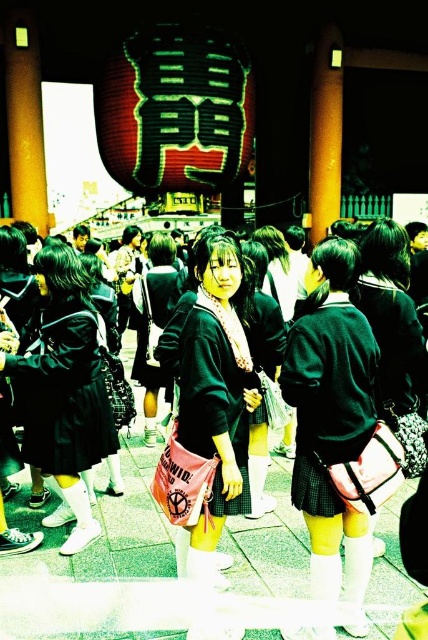
Which of these two, matte green uniform at center or matte black sweater at center, stands shorter?

matte green uniform at center is shorter.

Does matte green uniform at center have a larger size compared to matte black sweater at center?

Correct, matte green uniform at center is larger in size than matte black sweater at center.

Between point (357, 321) and point (190, 552), which one is positioned behind?

Positioned behind is point (357, 321).

This screenshot has width=428, height=640. I want to click on matte green uniform at center, so click(332, 420).

Is matte black sweater at center bigger than green plaid skirt at center?

Yes.

Which of these two, matte black sweater at center or green plaid skirt at center, stands taller?

matte black sweater at center

Who is more distant from viewer, (244, 467) or (326, 413)?

The point (244, 467) is behind.

This screenshot has height=640, width=428. In order to click on matte black sweater at center in this screenshot , I will do `click(210, 422)`.

Does matte green uniform at center have a smaller size compared to shiny red paper lantern at upper center?

No, matte green uniform at center is not smaller than shiny red paper lantern at upper center.

Which is above, matte green uniform at center or shiny red paper lantern at upper center?

Positioned higher is shiny red paper lantern at upper center.

You are a GUI agent. You are given a task and a screenshot of the screen. Output one action in this format:
    pyautogui.click(x=<x>, y=<y>)
    Task: Click on the matte green uniform at center
    
    Given the screenshot: What is the action you would take?
    pyautogui.click(x=332, y=420)